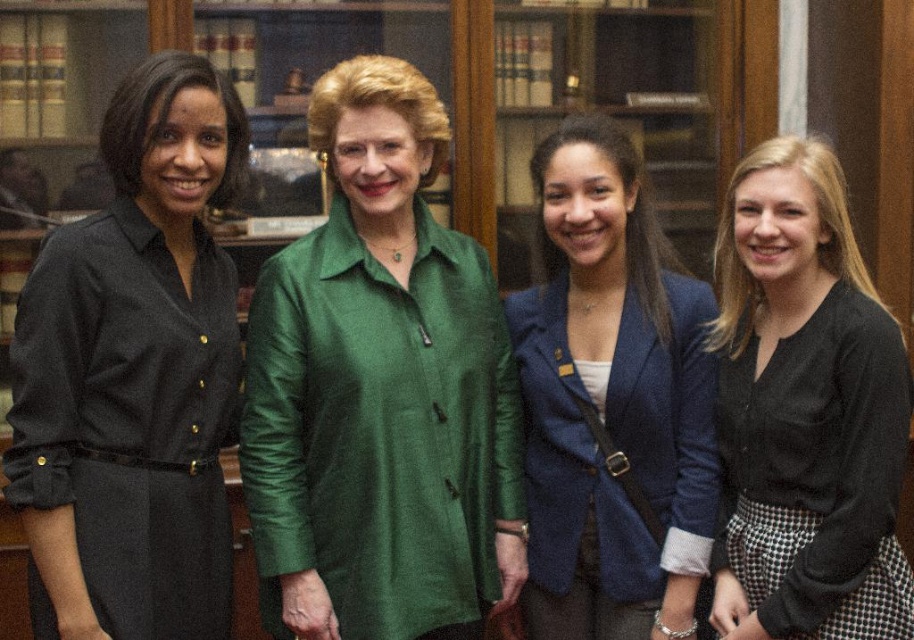
Does point (601, 237) come closer to viewer compared to point (891, 637)?

No, it is behind (891, 637).

Based on the photo, who is more forward, (547, 448) or (905, 600)?

Point (905, 600) is in front.

The height and width of the screenshot is (640, 914). What are the coordinates of `blue textured blazer at center` in the screenshot? It's located at (611, 403).

Can you confirm if green silk blouse at center is positioned above black matte sweater at right?

Correct, green silk blouse at center is located above black matte sweater at right.

How distant is green silk blouse at center from black matte sweater at right?

green silk blouse at center is 25.69 inches from black matte sweater at right.

The height and width of the screenshot is (640, 914). I want to click on green silk blouse at center, so click(x=380, y=392).

I want to click on green silk blouse at center, so [x=380, y=392].

Does green silk blouse at center have a greater height compared to black dress at left?

Yes, green silk blouse at center is taller than black dress at left.

Is green silk blouse at center bigger than black dress at left?

Yes.

Which is in front, point (409, 410) or point (167, 108)?

Positioned in front is point (167, 108).

In order to click on green silk blouse at center in this screenshot , I will do `click(380, 392)`.